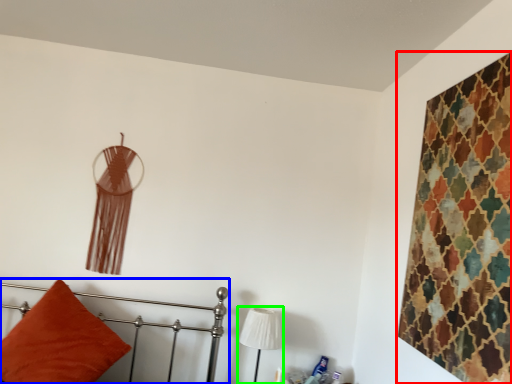
Question: Considering the real-world distances, which object is closest to textile (highlighted by a red box)? furniture (highlighted by a blue box) or table lamp (highlighted by a green box).

Choices:
 (A) furniture
 (B) table lamp

Answer: (B)